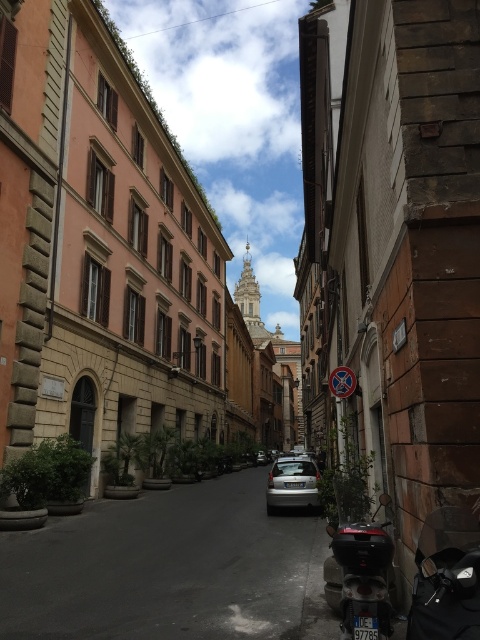
You are a delivery driver who needs to park your scooter between the silver metallic car at center and the satin silver sedan at center. Is there enough space between them for your scooter, which is 1.2 meters wide?

The silver metallic car at center is to the left of the satin silver sedan at center. Since the distance between them isn

You are a tourist standing at the point with coordinates point (459,589) in this historic European street scene. You want to walk to the point at point (276,476). Based on the spatial relationship between these two points, which direction should you move relative to your current position?

Since point (459,589) is in front of point (276,476), you should move backward to reach point (276,476) from your current position at point (459,589).